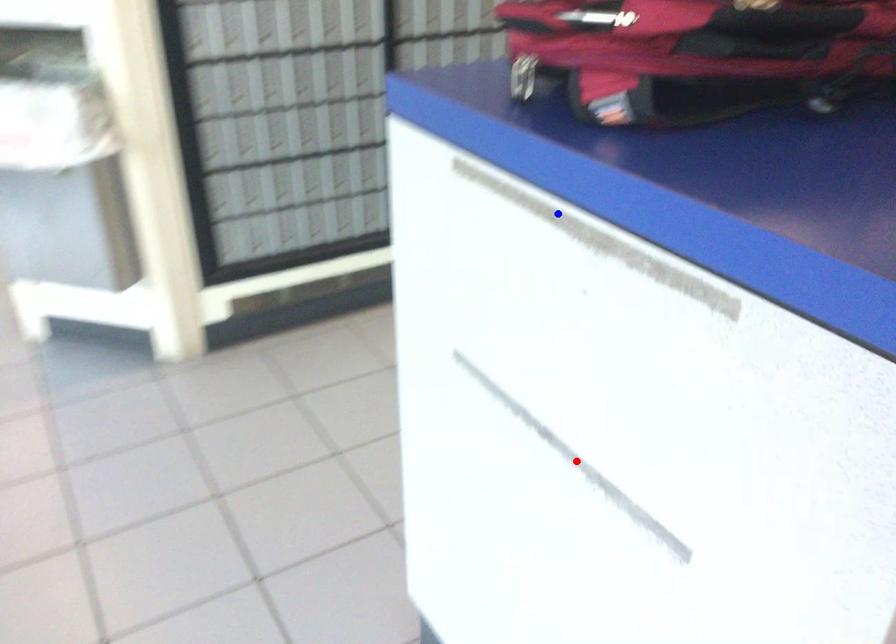
Question: Which of the two points in the image is closer to the camera?

Choices:
 (A) Blue point is closer.
 (B) Red point is closer.

Answer: (A)